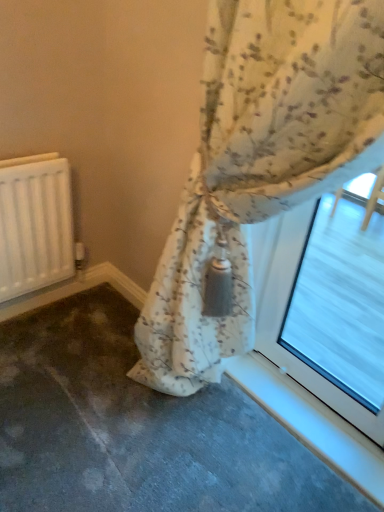
Question: From a real-world perspective, is floral fabric curtain at center located higher than transparent glass at upper right?

Choices:
 (A) yes
 (B) no

Answer: (A)

Question: From the image's perspective, is floral fabric curtain at center under transparent glass at upper right?

Choices:
 (A) yes
 (B) no

Answer: (B)

Question: Can you confirm if floral fabric curtain at center is smaller than transparent glass at upper right?

Choices:
 (A) no
 (B) yes

Answer: (A)

Question: From a real-world perspective, is floral fabric curtain at center positioned under transparent glass at upper right based on gravity?

Choices:
 (A) no
 (B) yes

Answer: (A)

Question: Considering the relative sizes of floral fabric curtain at center and transparent glass at upper right in the image provided, is floral fabric curtain at center shorter than transparent glass at upper right?

Choices:
 (A) yes
 (B) no

Answer: (B)

Question: From the image's perspective, would you say floral fabric curtain at center is positioned over transparent glass at upper right?

Choices:
 (A) yes
 (B) no

Answer: (A)

Question: Can you confirm if floral fabric curtain at center is taller than white matte radiator at left?

Choices:
 (A) no
 (B) yes

Answer: (B)

Question: Does floral fabric curtain at center contain white matte radiator at left?

Choices:
 (A) yes
 (B) no

Answer: (B)

Question: Is the depth of floral fabric curtain at center greater than that of white matte radiator at left?

Choices:
 (A) no
 (B) yes

Answer: (A)

Question: Is floral fabric curtain at center placed right next to white matte radiator at left?

Choices:
 (A) no
 (B) yes

Answer: (A)

Question: From a real-world perspective, is floral fabric curtain at center on top of white matte radiator at left?

Choices:
 (A) no
 (B) yes

Answer: (B)

Question: Is floral fabric curtain at center facing towards white matte radiator at left?

Choices:
 (A) no
 (B) yes

Answer: (A)

Question: Is white matte radiator at left not close to transparent glass at upper right?

Choices:
 (A) yes
 (B) no

Answer: (A)